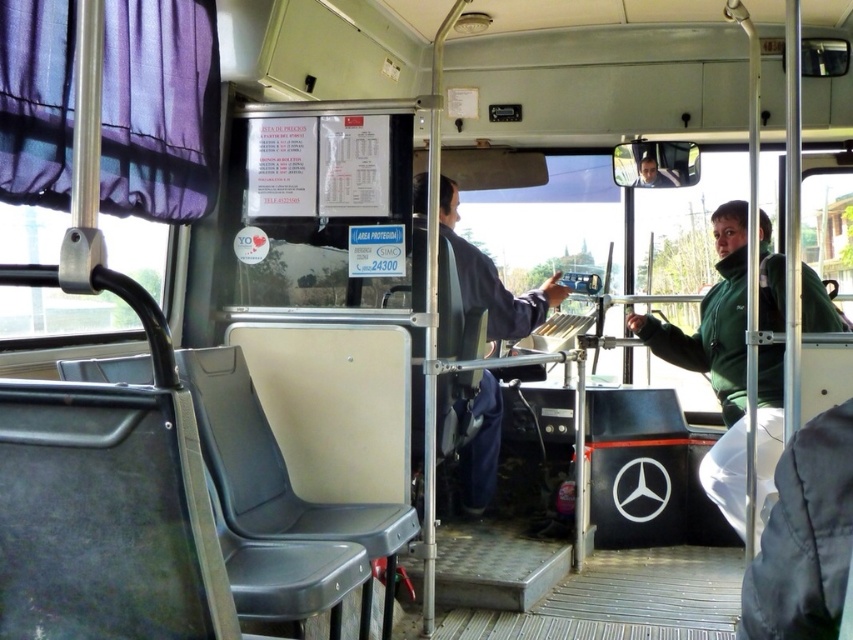
Between green matte jacket at right and dark blue fabric jacket at center, which one appears on the right side from the viewer's perspective?

green matte jacket at right

Which is in front, point (640, 321) or point (422, 198)?

Point (422, 198) is in front.

The width and height of the screenshot is (853, 640). I want to click on green matte jacket at right, so click(x=717, y=358).